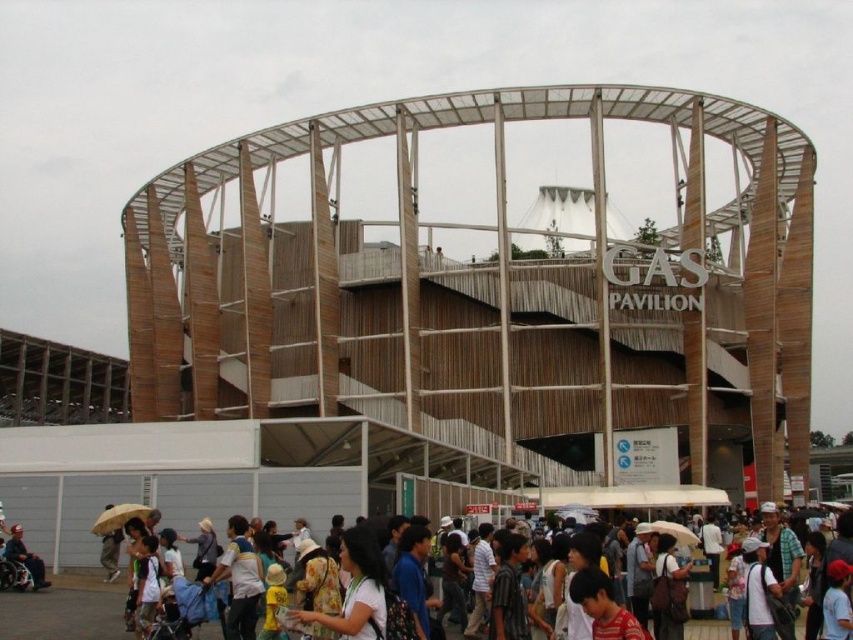
Question: Where is dark gray fabric wheelchair at lower left located in relation to yellow matte umbrella at lower left in the image?

Choices:
 (A) left
 (B) right

Answer: (A)

Question: Which point appears farthest from the camera in this image?

Choices:
 (A) (106, 515)
 (B) (4, 557)

Answer: (B)

Question: Which point is farther from the camera taking this photo?

Choices:
 (A) (38, 588)
 (B) (115, 515)

Answer: (A)

Question: Which point appears closest to the camera in this image?

Choices:
 (A) (122, 522)
 (B) (38, 577)

Answer: (A)

Question: Does dark gray fabric wheelchair at lower left come behind yellow matte umbrella at lower left?

Choices:
 (A) no
 (B) yes

Answer: (B)

Question: Can you confirm if dark gray fabric wheelchair at lower left is smaller than yellow matte umbrella at lower left?

Choices:
 (A) yes
 (B) no

Answer: (B)